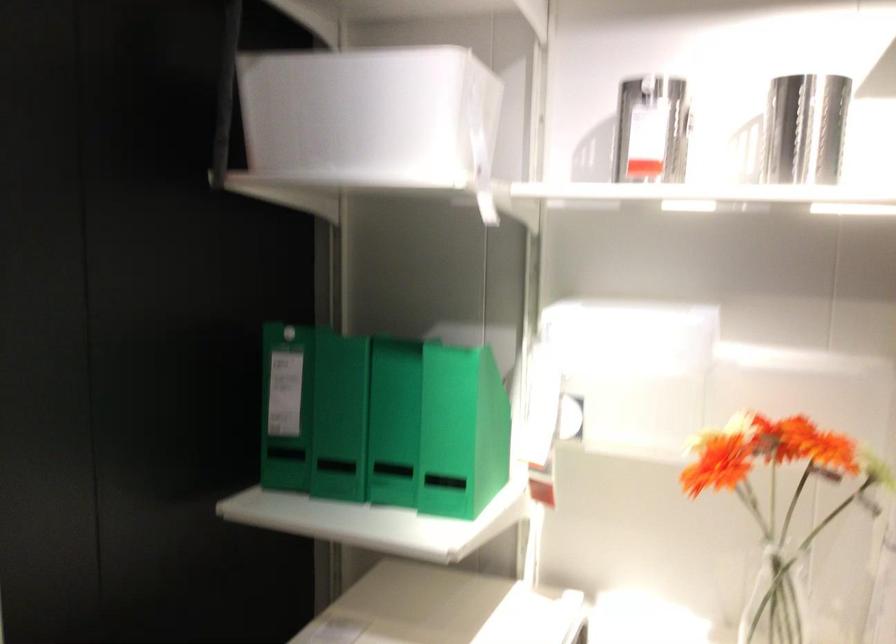
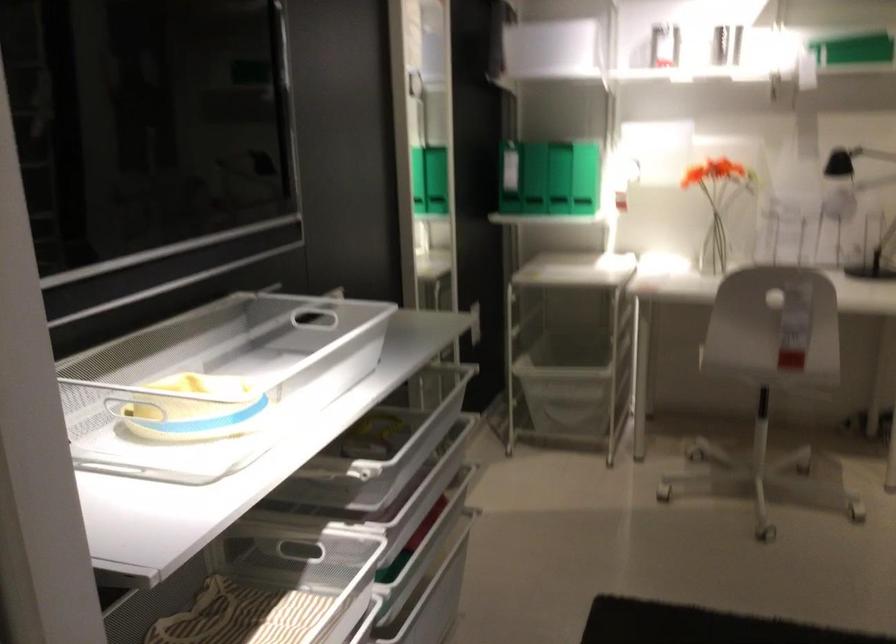
Where in the second image is the point corresponding to pixel 277 415 from the first image?

(511, 174)